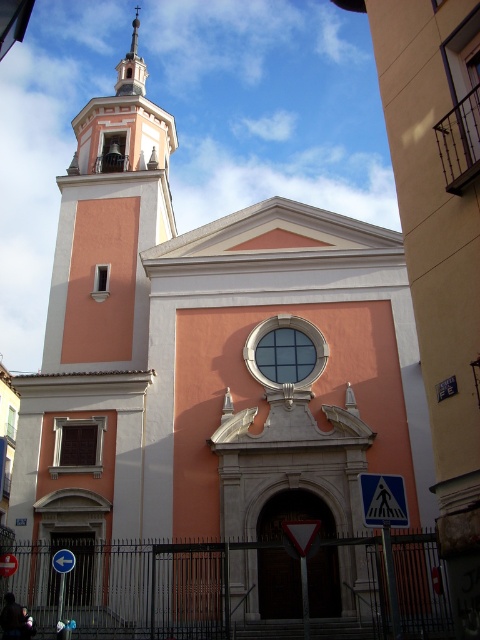
You are standing in front of the church and want to take a photo that includes both the smooth pink tower at upper left and the smooth white spire at upper center. Which one of these objects is positioned lower in the image?

The smooth pink tower at upper left is positioned below the smooth white spire at upper center, so the smooth pink tower at upper left is lower in the image.

You are standing in front of the church and want to locate the smooth pink tower at upper left. Where exactly is it positioned on the facade?

The smooth pink tower at upper left is positioned at point coordinates of 0.347 on the x axis and 0.229 on the y axis.